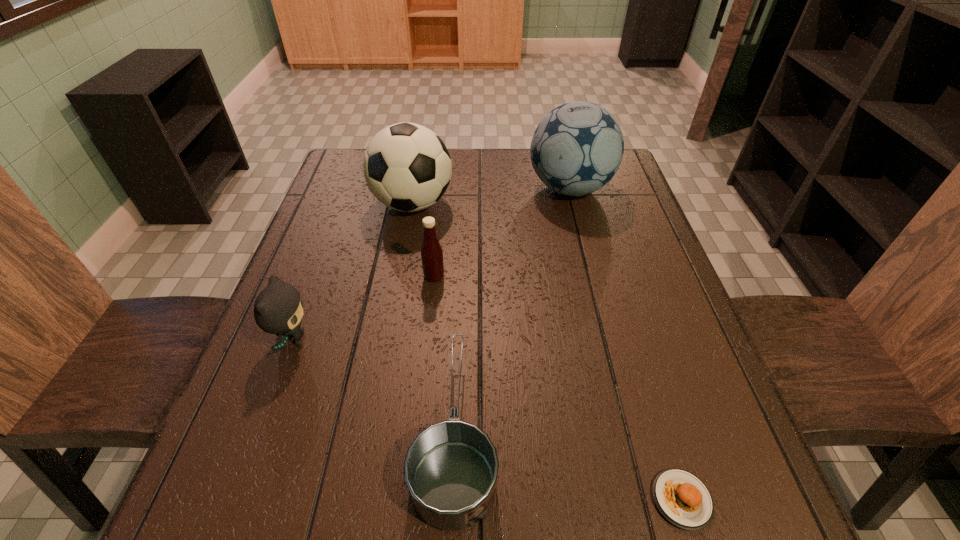
Find the location of a particular element. the right soccer ball is located at coordinates pyautogui.click(x=577, y=148).

The image size is (960, 540). I want to click on the left soccer ball, so click(x=407, y=167).

Identify the location of Tabasco sauce. (431, 252).

Where is `kitten`? This screenshot has width=960, height=540. kitten is located at coordinates (278, 309).

The width and height of the screenshot is (960, 540). Find the location of `the second shortest object`. the second shortest object is located at coordinates (451, 467).

At what (x,y) coordinates should I click in order to perform the action: click on food. Please return your answer as a coordinate pair (x, y). The image size is (960, 540). Looking at the image, I should click on (682, 498).

At what (x,y) coordinates should I click in order to perform the action: click on free spot located on the side with brand of the right soccer ball. Please return your answer as a coordinate pair (x, y). The width and height of the screenshot is (960, 540). Looking at the image, I should click on (507, 188).

You are a GUI agent. You are given a task and a screenshot of the screen. Output one action in this format:
    pyautogui.click(x=<x>, y=<y>)
    Task: Click on the free space located on the side with brand of the right soccer ball
    
    Given the screenshot: What is the action you would take?
    pyautogui.click(x=427, y=188)

You are a GUI agent. You are given a task and a screenshot of the screen. Output one action in this format:
    pyautogui.click(x=<x>, y=<y>)
    Task: Click on the vacant space located on the side with brand of the right soccer ball
    
    Given the screenshot: What is the action you would take?
    pyautogui.click(x=438, y=188)

Where is `free space located on the left of the left soccer ball`? The height and width of the screenshot is (540, 960). free space located on the left of the left soccer ball is located at coordinates (347, 204).